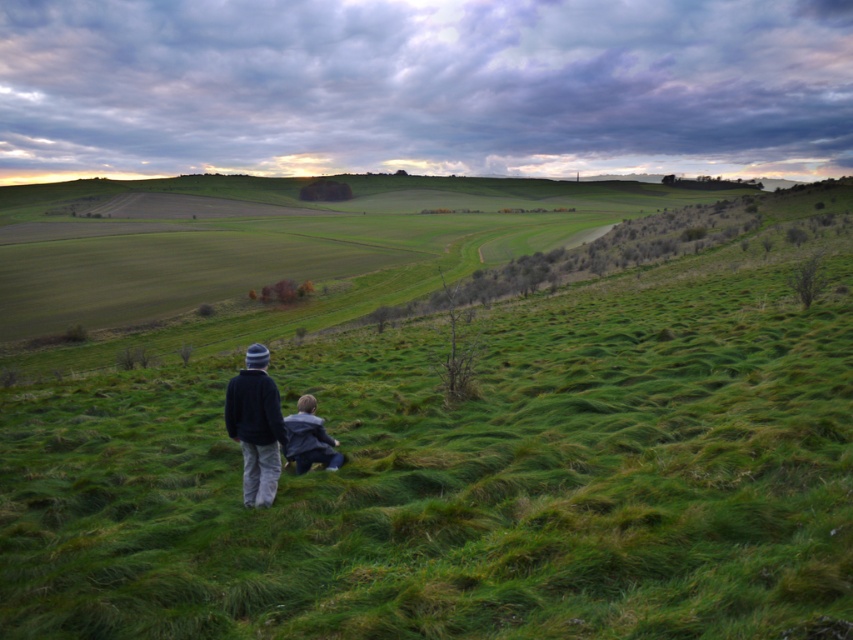
Is green grassy hillside at center below dark blue sweater at center?

No, green grassy hillside at center is not below dark blue sweater at center.

In the scene shown: Can you confirm if green grassy hillside at center is smaller than dark blue sweater at center?

Incorrect, green grassy hillside at center is not smaller in size than dark blue sweater at center.

Locate an element on the screen. green grassy hillside at center is located at coordinates (425, 417).

Can you confirm if green grassy hillside at center is positioned to the left of blue denim jacket at lower center?

Yes, green grassy hillside at center is to the left of blue denim jacket at lower center.

This screenshot has width=853, height=640. I want to click on green grassy hillside at center, so click(x=425, y=417).

Locate an element on the screen. dark blue sweater at center is located at coordinates (254, 426).

Does point (256, 394) come farther from viewer compared to point (306, 428)?

No, it is not.

The image size is (853, 640). In order to click on dark blue sweater at center in this screenshot , I will do `click(254, 426)`.